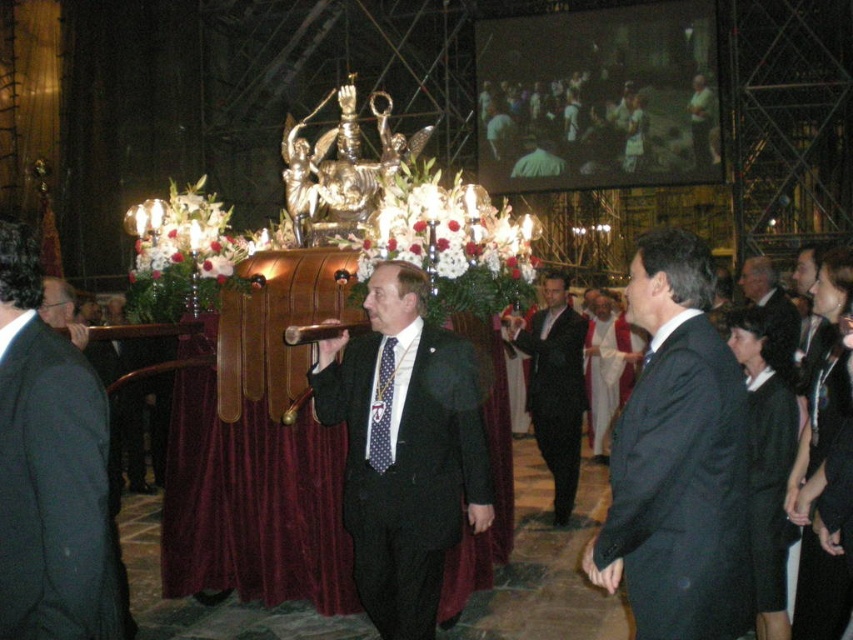
Question: Which is farther from the polka dot silk tie at center?

Choices:
 (A) black textured suit at center
 (B) dark gray suit at center

Answer: (A)

Question: Can you confirm if dark gray suit at center is positioned to the left of dark suit at center?

Choices:
 (A) no
 (B) yes

Answer: (B)

Question: Which of these objects is positioned farthest from the black suit at center?

Choices:
 (A) polka dot silk tie at center
 (B) dark gray suit at center
 (C) dark suit at center

Answer: (B)

Question: Is black suit at center to the left of black satin suit at center from the viewer's perspective?

Choices:
 (A) yes
 (B) no

Answer: (B)

Question: Observing the image, what is the correct spatial positioning of black suit at center in reference to black satin suit at center?

Choices:
 (A) left
 (B) right

Answer: (B)

Question: Among these objects, which one is farthest from the camera?

Choices:
 (A) polka dot silk tie at center
 (B) black textured suit at center

Answer: (B)